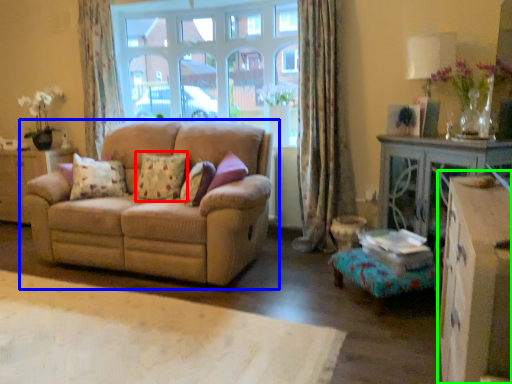
Question: Considering the real-world distances, which object is closest to pillow (highlighted by a red box)? studio couch (highlighted by a blue box) or dresser (highlighted by a green box).

Choices:
 (A) studio couch
 (B) dresser

Answer: (A)